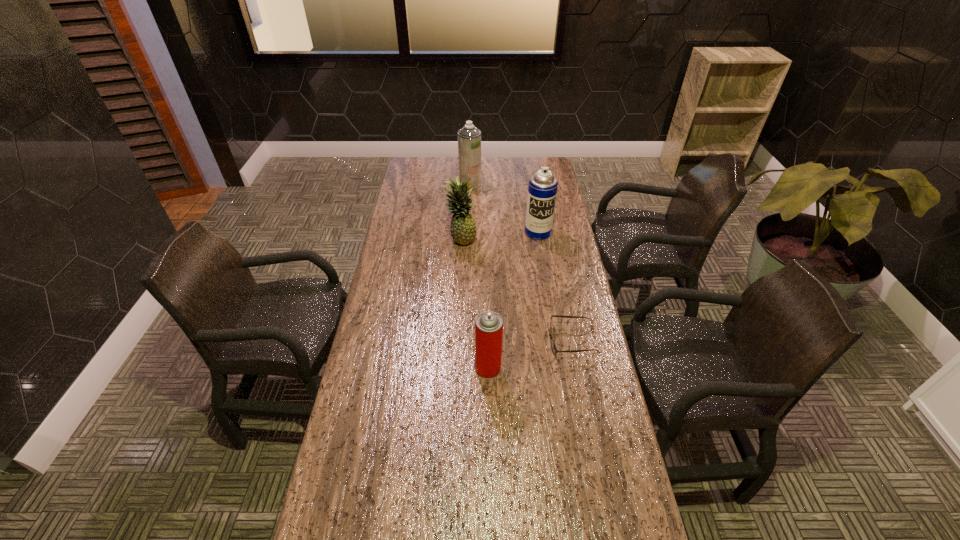
I want to click on the farthest object, so click(469, 137).

This screenshot has height=540, width=960. Identify the location of the rightmost aerosol can. pos(542,190).

Image resolution: width=960 pixels, height=540 pixels. Find the location of `pineapple`. pineapple is located at coordinates (463, 228).

Image resolution: width=960 pixels, height=540 pixels. In order to click on the nearest aerosol can in this screenshot , I will do `click(488, 325)`.

Locate an element on the screen. The height and width of the screenshot is (540, 960). the second shortest object is located at coordinates (488, 325).

You are a GUI agent. You are given a task and a screenshot of the screen. Output one action in this format:
    pyautogui.click(x=<x>, y=<y>)
    Task: Click on the sunglasses
    
    Given the screenshot: What is the action you would take?
    pyautogui.click(x=553, y=346)

You are a GUI agent. You are given a task and a screenshot of the screen. Output one action in this format:
    pyautogui.click(x=<x>, y=<y>)
    Task: Click on the free space located 0.170m on the front of the farthest object
    Image resolution: width=960 pixels, height=540 pixels.
    Given the screenshot: What is the action you would take?
    (x=469, y=211)

Locate an element on the screen. This screenshot has width=960, height=540. vacant area situated on the label side of the rightmost aerosol can is located at coordinates (545, 279).

At what (x,y) coordinates should I click in order to perform the action: click on free spot located 0.370m on the right of the pineapple. Please return your answer as a coordinate pair (x, y). This screenshot has width=960, height=540. Looking at the image, I should click on (567, 239).

Locate an element on the screen. The width and height of the screenshot is (960, 540). vacant point located 0.170m on the back of the nearest aerosol can is located at coordinates (488, 318).